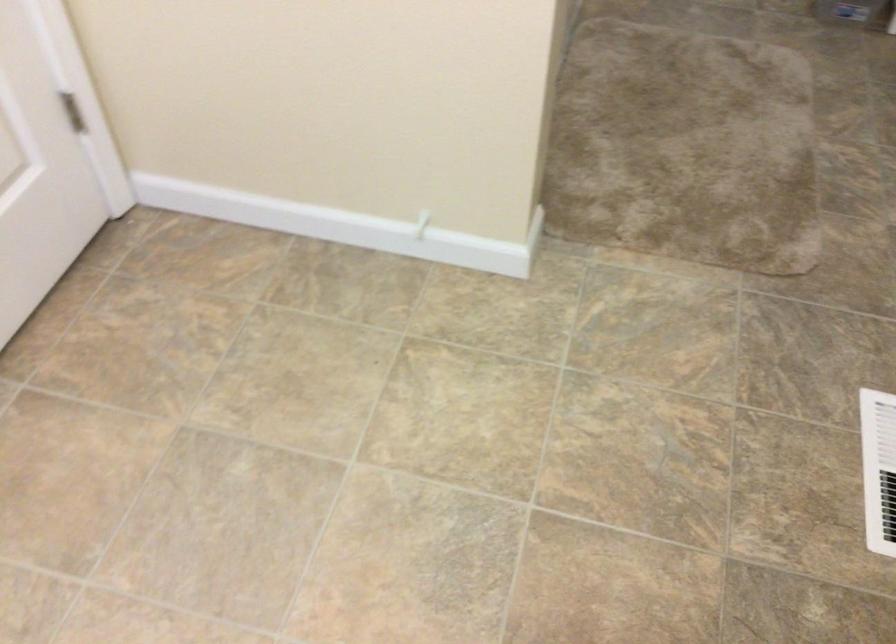
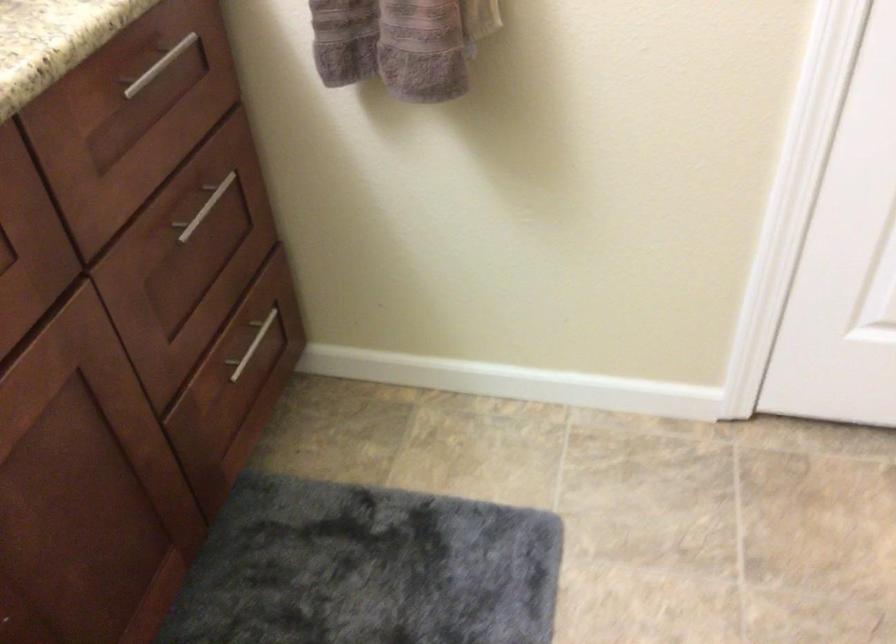
How did the camera likely rotate?

The camera rotated toward left-down.